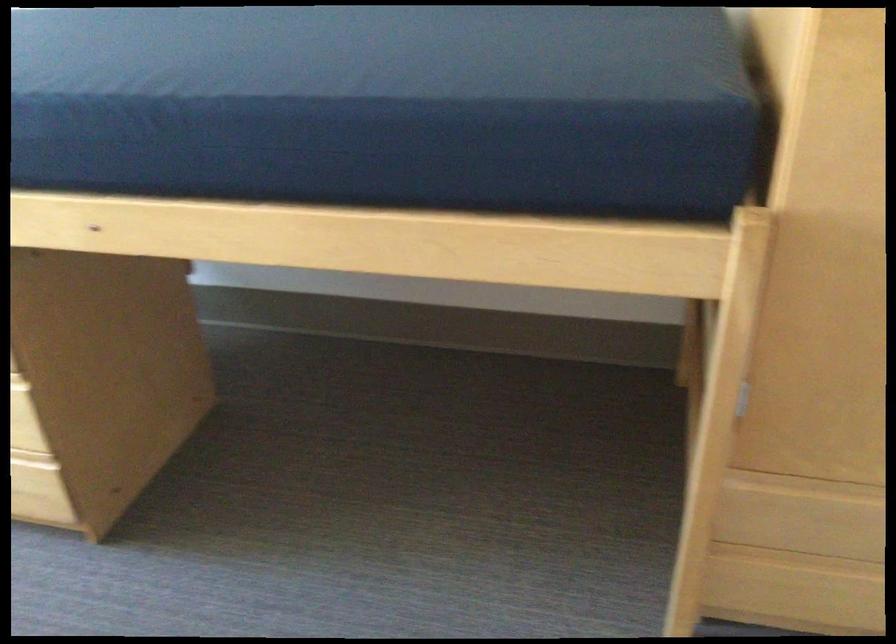
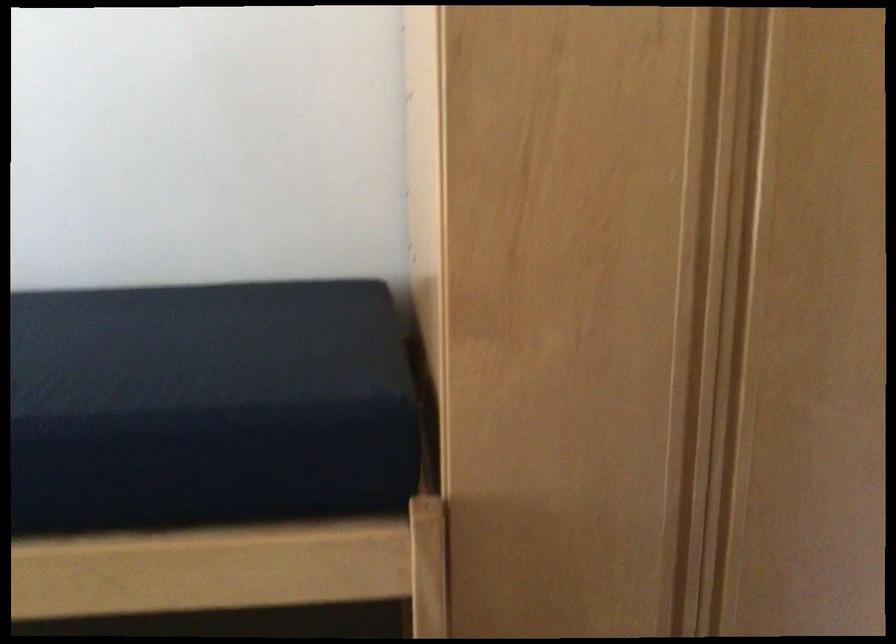
Question: What movement of the cameraman would produce the second image?

Choices:
 (A) Left
 (B) Right
 (C) Forward
 (D) Backward

Answer: (B)